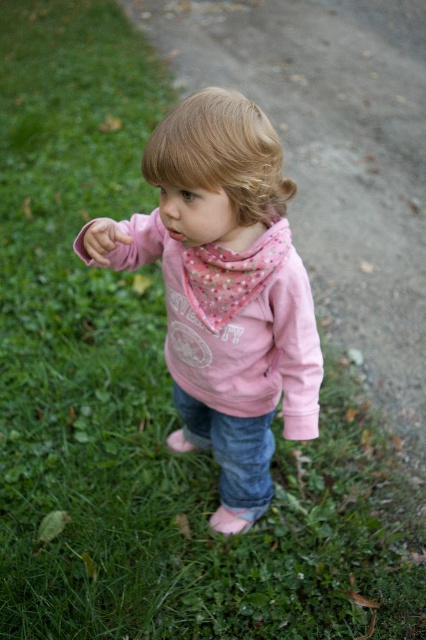
Is pink cotton hoodie at center positioned before matte pink hand at center?

That is True.

Can you confirm if pink cotton hoodie at center is wider than matte pink hand at center?

Correct, the width of pink cotton hoodie at center exceeds that of matte pink hand at center.

Measure the distance between point (163, 232) and camera.

A distance of 5.67 feet exists between point (163, 232) and camera.

Locate an element on the screen. The width and height of the screenshot is (426, 640). pink cotton hoodie at center is located at coordinates (229, 292).

Who is higher up, pink cotton hoodie at center or denim jeans at lower center?

pink cotton hoodie at center is higher up.

Find the location of a particular element. pink cotton hoodie at center is located at coordinates (229, 292).

Locate an element on the screen. This screenshot has height=640, width=426. pink cotton hoodie at center is located at coordinates (229, 292).

The height and width of the screenshot is (640, 426). In order to click on pink cotton hoodie at center in this screenshot , I will do `click(229, 292)`.

Can you confirm if pink cotton hoodie at center is positioned below blonde silky hair at center?

Yes, pink cotton hoodie at center is below blonde silky hair at center.

Between pink cotton hoodie at center and blonde silky hair at center, which one is positioned lower?

pink cotton hoodie at center is lower down.

The width and height of the screenshot is (426, 640). I want to click on pink cotton hoodie at center, so click(x=229, y=292).

Find the location of `pink cotton hoodie at center`. pink cotton hoodie at center is located at coordinates (229, 292).